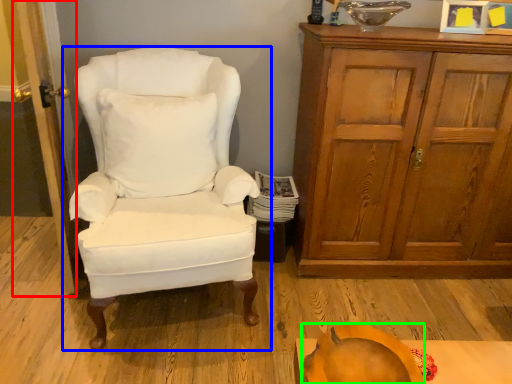
Question: Considering the real-world distances, which object is closest to door (highlighted by a red box)? chair (highlighted by a blue box) or pumpkin (highlighted by a green box).

Choices:
 (A) chair
 (B) pumpkin

Answer: (A)